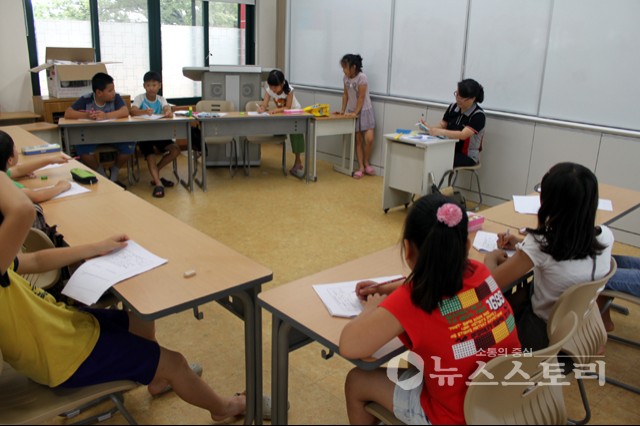
Find the location of a particular element. This screenshot has width=640, height=426. desks is located at coordinates (372, 261), (632, 200), (162, 225), (72, 163), (33, 136), (43, 128), (125, 122), (246, 122), (335, 122), (395, 166).